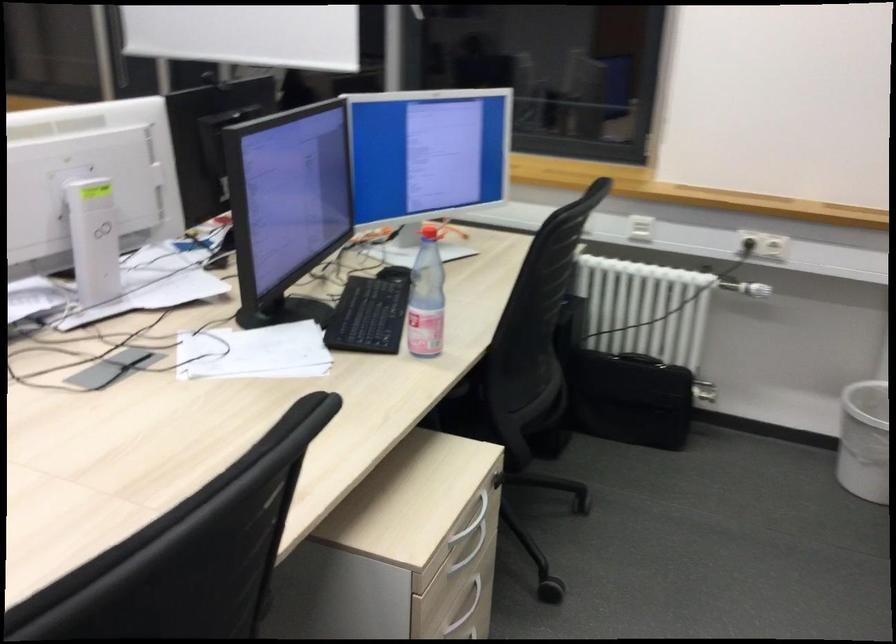
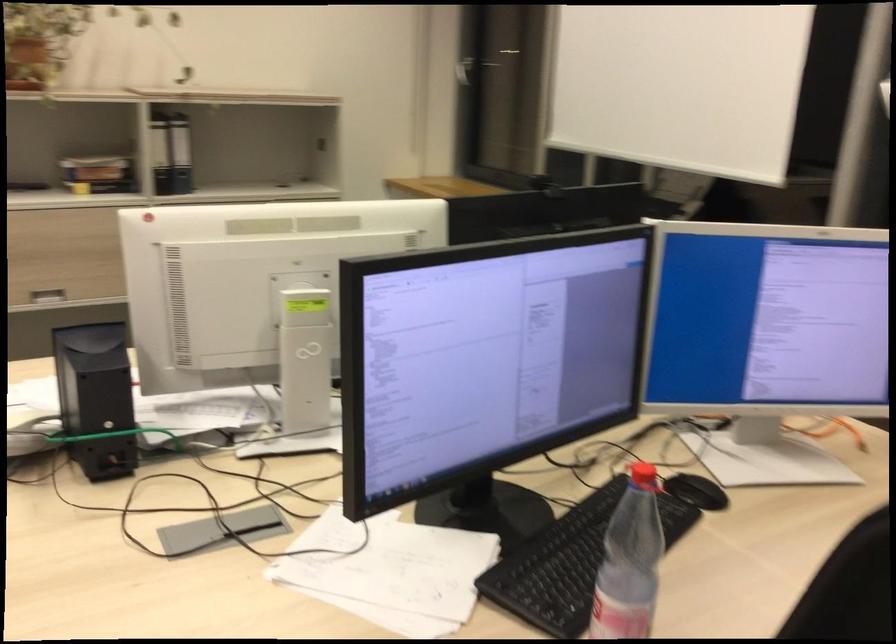
The point at (431, 234) is marked in the first image. Where is the corresponding point in the second image?

(642, 478)